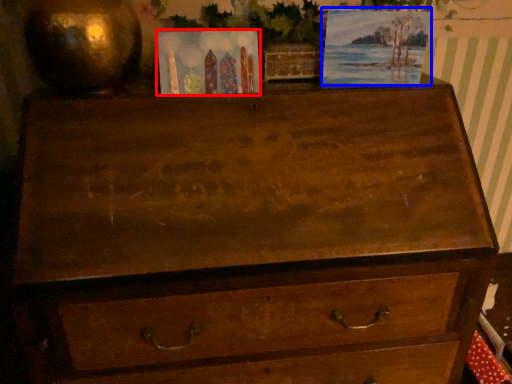
Question: Which object appears closest to the camera in this image, postcard (highlighted by a red box) or picture frame (highlighted by a blue box)?

Choices:
 (A) postcard
 (B) picture frame

Answer: (A)